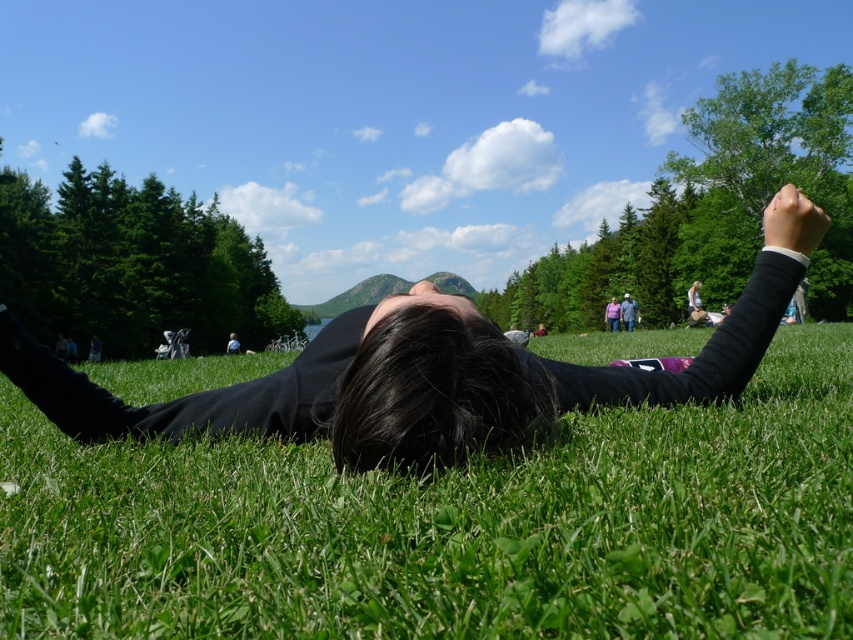
You are a photographer trying to capture the perfect shot of the black matte person at center and the gray fabric jacket at center. Based on their positions, which object is closer to the camera?

The black matte person at center is closer to the camera because they are positioned below the gray fabric jacket at center, indicating that the person is in front of the jacket.

You are standing at the point labeled as point (451, 525) in the image. What is the color of the ground beneath your feet?

The point (451, 525) indicates green grass at center, so the ground beneath your feet is green grass.